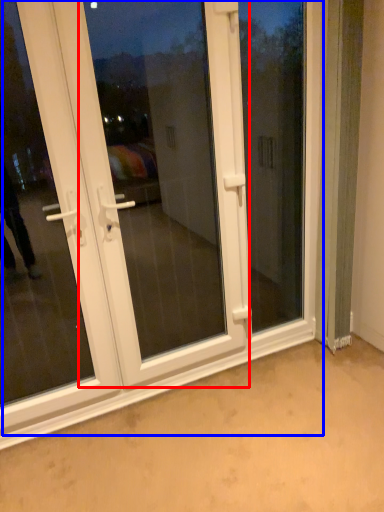
Question: Which object appears closest to the camera in this image, screen door (highlighted by a red box) or door (highlighted by a blue box)?

Choices:
 (A) screen door
 (B) door

Answer: (B)